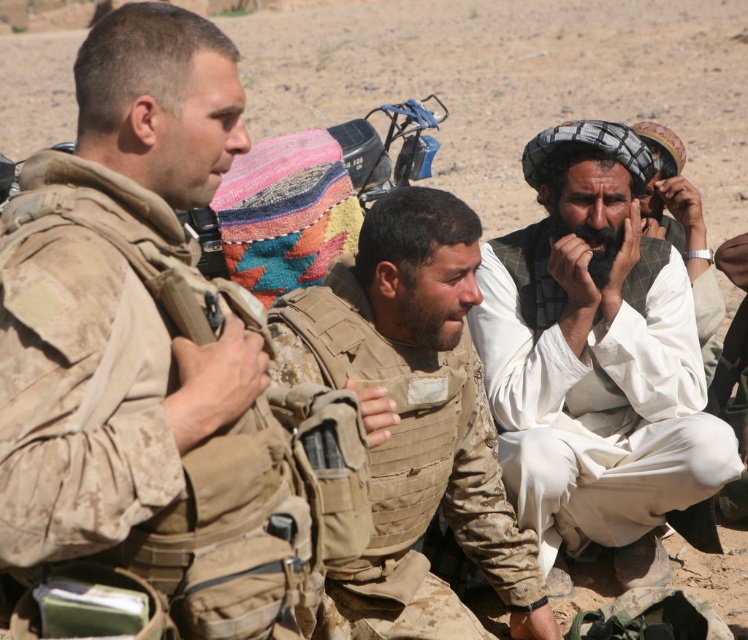
You are a drone operator observing the desert scene. You need to determine if a small drone with a 30 inch wingspan can fly between the white cotton robe at right and the white woven hat at upper right without touching either. Can it?

The distance between the white cotton robe at right and the white woven hat at upper right is 32.56 inches. Since the drone has a wingspan of 30 inches, it can safely fly through the gap without touching either object.